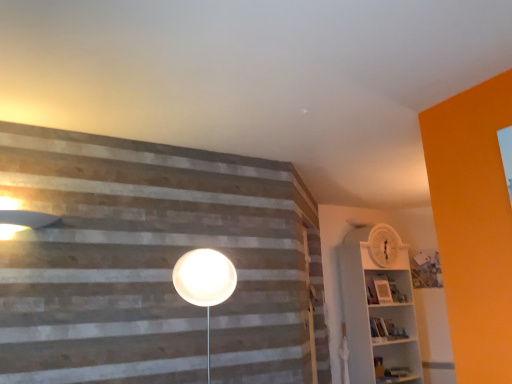
Question: Is white plastic shelf at right far away from white matte barn door at center?

Choices:
 (A) no
 (B) yes

Answer: (A)

Question: Does white plastic shelf at right have a smaller size compared to white matte barn door at center?

Choices:
 (A) yes
 (B) no

Answer: (B)

Question: Is white plastic shelf at right not inside white matte barn door at center?

Choices:
 (A) yes
 (B) no

Answer: (A)

Question: Is white plastic shelf at right bigger than white matte barn door at center?

Choices:
 (A) yes
 (B) no

Answer: (A)

Question: Is white plastic shelf at right positioned before white matte barn door at center?

Choices:
 (A) no
 (B) yes

Answer: (A)

Question: Looking at their shapes, would you say white plastic shelf at right is wider or thinner than white matte barn door at center?

Choices:
 (A) thin
 (B) wide

Answer: (B)

Question: From their relative heights in the image, would you say white plastic shelf at right is taller or shorter than white matte barn door at center?

Choices:
 (A) tall
 (B) short

Answer: (A)

Question: In terms of size, does white plastic shelf at right appear bigger or smaller than white matte barn door at center?

Choices:
 (A) small
 (B) big

Answer: (B)

Question: Visually, is white plastic shelf at right positioned to the left or to the right of white matte barn door at center?

Choices:
 (A) left
 (B) right

Answer: (B)

Question: Would you say matte white lampshade at upper left is to the left or to the right of white plastic shelf at right in the picture?

Choices:
 (A) right
 (B) left

Answer: (B)

Question: Is matte white lampshade at upper left bigger or smaller than white plastic shelf at right?

Choices:
 (A) big
 (B) small

Answer: (B)

Question: Is matte white lampshade at upper left in front of or behind white plastic shelf at right in the image?

Choices:
 (A) behind
 (B) front

Answer: (B)

Question: From the image's perspective, is matte white lampshade at upper left above or below white plastic shelf at right?

Choices:
 (A) below
 (B) above

Answer: (B)

Question: From their relative heights in the image, would you say white plastic shelf at right is taller or shorter than matte white lampshade at upper left?

Choices:
 (A) short
 (B) tall

Answer: (B)

Question: Considering the positions of white plastic shelf at right and matte white lampshade at upper left in the image, is white plastic shelf at right bigger or smaller than matte white lampshade at upper left?

Choices:
 (A) big
 (B) small

Answer: (A)